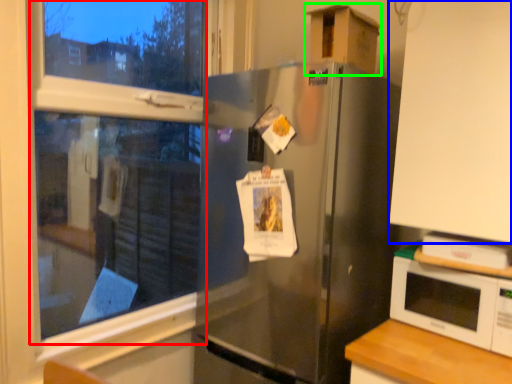
Question: Which object is positioned farthest from bay window (highlighted by a red box)? Select from cabinetry (highlighted by a blue box) and cardboard box (highlighted by a green box).

Choices:
 (A) cabinetry
 (B) cardboard box

Answer: (A)